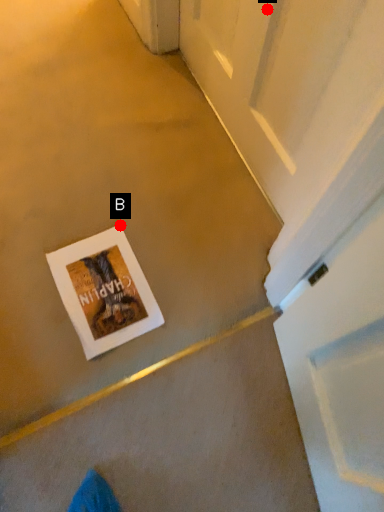
Question: Two points are circled on the image, labeled by A and B beside each circle. Which point is closer to the camera taking this photo?

Choices:
 (A) A is closer
 (B) B is closer

Answer: (A)